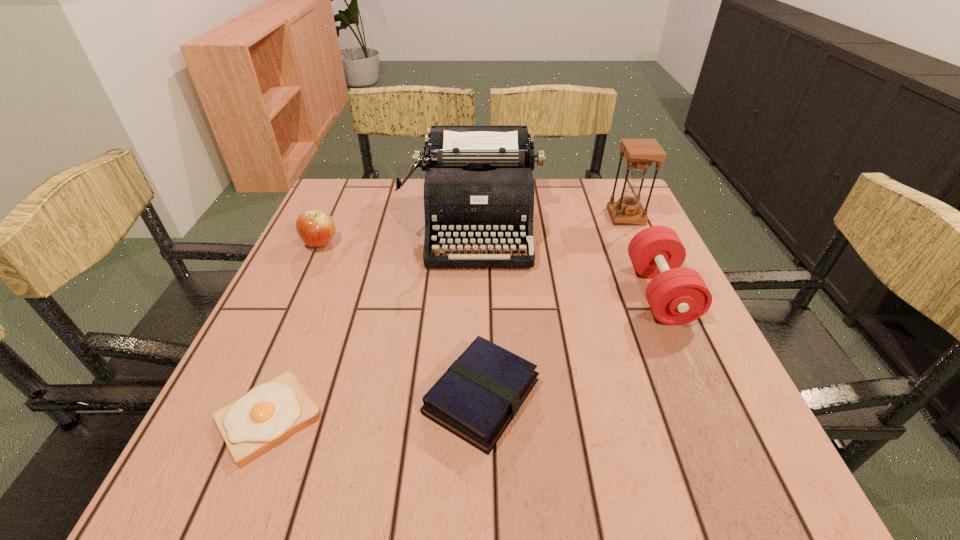
Where is `vacant position located on the back of the book`? vacant position located on the back of the book is located at coordinates coord(481,265).

The height and width of the screenshot is (540, 960). Find the location of `free space located 0.280m on the back of the toast`. free space located 0.280m on the back of the toast is located at coordinates (326, 274).

Identify the location of hourglass located in the far edge section of the desktop. (640, 153).

Locate an element on the screen. typewriter situated at the far edge is located at coordinates (478, 189).

Find the location of a particular element. The height and width of the screenshot is (540, 960). book present at the near edge is located at coordinates (477, 397).

I want to click on toast that is at the near edge, so click(x=269, y=413).

At what (x,y) coordinates should I click in order to perform the action: click on apple that is at the left edge. Please return your answer as a coordinate pair (x, y). Looking at the image, I should click on click(316, 228).

Where is `toast that is at the left edge`? The height and width of the screenshot is (540, 960). toast that is at the left edge is located at coordinates (269, 413).

Where is `hourglass present at the right edge`? hourglass present at the right edge is located at coordinates (640, 153).

Image resolution: width=960 pixels, height=540 pixels. I want to click on dumbbell positioned at the right edge, so click(677, 295).